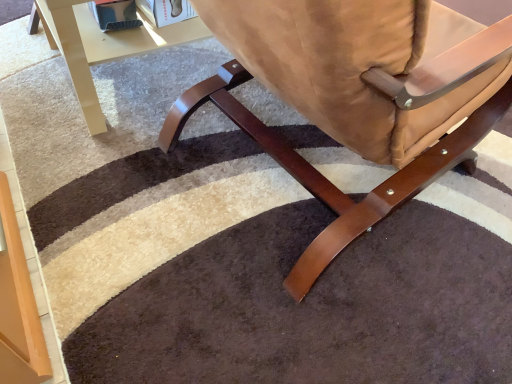
Question: From the image's perspective, is satin brown leather chair at center above or below glossy beige table at upper left?

Choices:
 (A) below
 (B) above

Answer: (A)

Question: Considering the positions of satin brown leather chair at center and glossy beige table at upper left in the image, is satin brown leather chair at center wider or thinner than glossy beige table at upper left?

Choices:
 (A) thin
 (B) wide

Answer: (B)

Question: Considering their positions, is satin brown leather chair at center located in front of or behind glossy beige table at upper left?

Choices:
 (A) behind
 (B) front

Answer: (B)

Question: From a real-world perspective, relative to satin brown leather chair at center, is glossy beige table at upper left vertically above or below?

Choices:
 (A) above
 (B) below

Answer: (B)

Question: From their relative heights in the image, would you say glossy beige table at upper left is taller or shorter than satin brown leather chair at center?

Choices:
 (A) short
 (B) tall

Answer: (A)

Question: Is glossy beige table at upper left bigger or smaller than satin brown leather chair at center?

Choices:
 (A) small
 (B) big

Answer: (A)

Question: Is glossy beige table at upper left in front of or behind satin brown leather chair at center in the image?

Choices:
 (A) behind
 (B) front

Answer: (A)